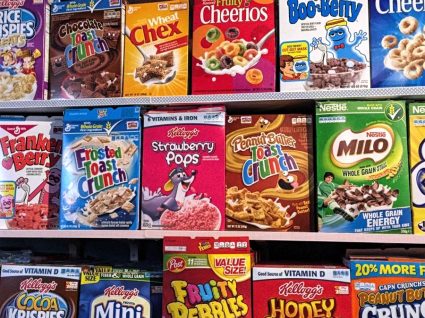
I want to click on cereal on the bottom row, so click(x=42, y=291), click(x=124, y=296), click(x=208, y=285), click(x=312, y=297), click(x=401, y=296).